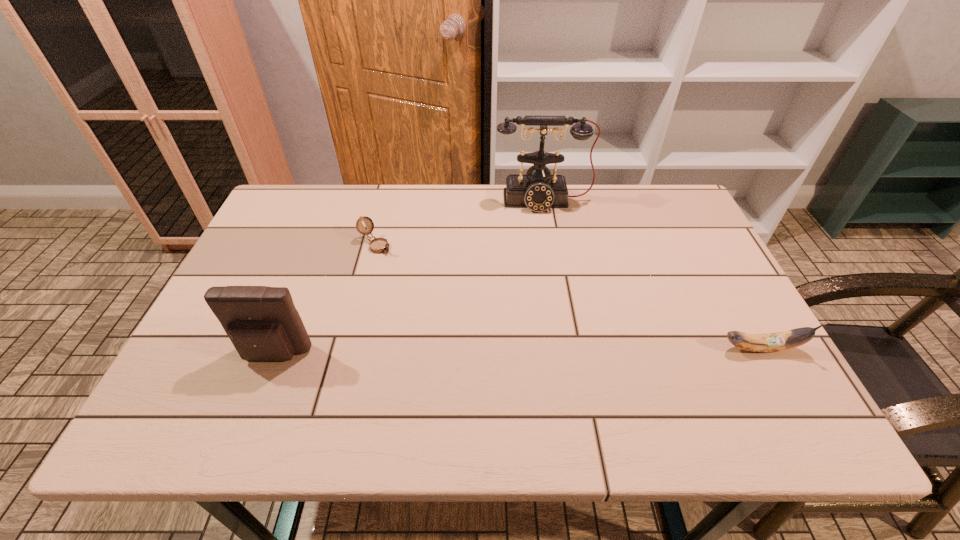
Locate an element on the screen. The image size is (960, 540). free space that is in between the compass and the rightmost object is located at coordinates (568, 296).

You are a GUI agent. You are given a task and a screenshot of the screen. Output one action in this format:
    pyautogui.click(x=<x>, y=<y>)
    Task: Click on the free space between the banana and the leftmost object
    The height and width of the screenshot is (540, 960).
    Given the screenshot: What is the action you would take?
    pyautogui.click(x=517, y=352)

I want to click on unoccupied area between the shortest object and the rightmost object, so click(568, 296).

What are the coordinates of `free space that is in between the third shortest object and the banana` in the screenshot? It's located at (517, 352).

You are a GUI agent. You are given a task and a screenshot of the screen. Output one action in this format:
    pyautogui.click(x=<x>, y=<y>)
    Task: Click on the vacant area between the farthest object and the second object from left to right
    The width and height of the screenshot is (960, 540).
    Given the screenshot: What is the action you would take?
    pyautogui.click(x=460, y=223)

Image resolution: width=960 pixels, height=540 pixels. What are the coordinates of `the third closest object relative to the tallest object` in the screenshot? It's located at (262, 322).

Locate which object is the third closest to the compass. Please provide its 2D coordinates. Your answer should be formatted as a tuple, i.e. [(x, y)], where the tuple contains the x and y coordinates of a point satisfying the conditions above.

[(785, 340)]

Find the location of a particular element. The width and height of the screenshot is (960, 540). free spot that satisfies the following two spatial constraints: 1. on the front side of the rightmost object; 2. at the stem of the shortest object is located at coordinates (349, 348).

At what (x,y) coordinates should I click in order to perform the action: click on vacant region that satisfies the following two spatial constraints: 1. on the back side of the second object from right to left; 2. on the left side of the third object from right to left. Please return your answer as a coordinate pair (x, y). Image resolution: width=960 pixels, height=540 pixels. Looking at the image, I should click on (387, 201).